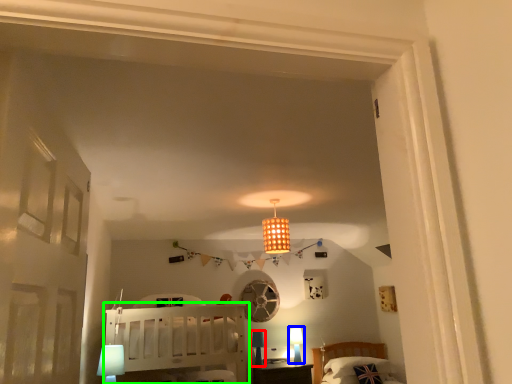
Question: Which object is the closest to the table lamp (highlighted by a red box)? Choose among these: table lamp (highlighted by a blue box) or furniture (highlighted by a green box).

Choices:
 (A) table lamp
 (B) furniture

Answer: (A)